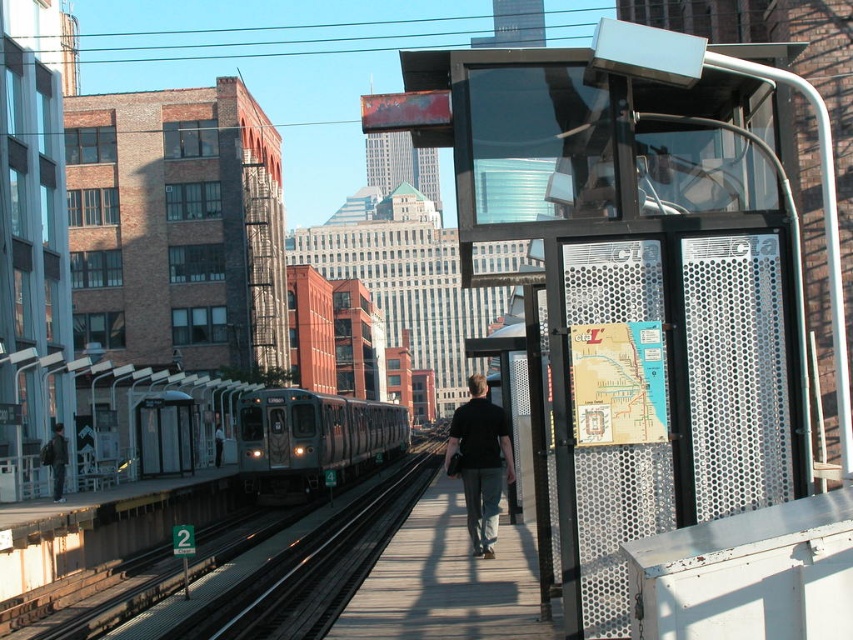
Is green metallic train at center thinner than dark gray pants at center?

No, green metallic train at center is not thinner than dark gray pants at center.

Does green metallic train at center have a lesser height compared to dark gray pants at center?

No, green metallic train at center is not shorter than dark gray pants at center.

Does point (397, 456) come in front of point (222, 442)?

No.

The width and height of the screenshot is (853, 640). Identify the location of green metallic train at center. (312, 440).

Which is more to the right, green metallic train at center or dark gray jacket at center?

From the viewer's perspective, green metallic train at center appears more on the right side.

Does green metallic train at center appear on the right side of dark gray jacket at center?

Yes, green metallic train at center is to the right of dark gray jacket at center.

Which is in front, point (270, 392) or point (45, 449)?

Point (45, 449) is more forward.

Where is `green metallic train at center`? The height and width of the screenshot is (640, 853). green metallic train at center is located at coordinates (312, 440).

In the scene shown: Can you confirm if black cotton shirt at center is thinner than dark gray pants at center?

Yes, black cotton shirt at center is thinner than dark gray pants at center.

Between point (486, 451) and point (221, 426), which one is positioned behind?

The point (221, 426) is more distant.

Is point (463, 404) positioned after point (218, 436)?

No.

Locate an element on the screen. Image resolution: width=853 pixels, height=640 pixels. black cotton shirt at center is located at coordinates (479, 461).